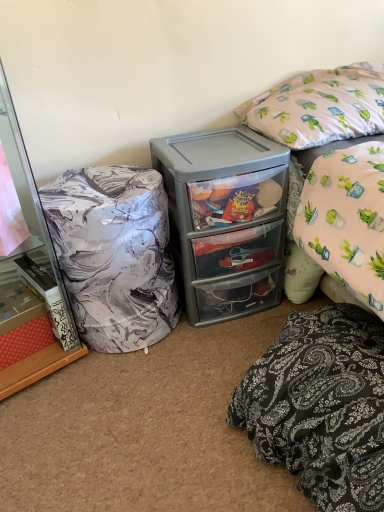
Find the location of a particular element. The image size is (384, 512). vacant area that lies between marble-patterned fabric at left and black paisley pillow at lower right, the 2th pillow when ordered from top to bottom is located at coordinates (155, 408).